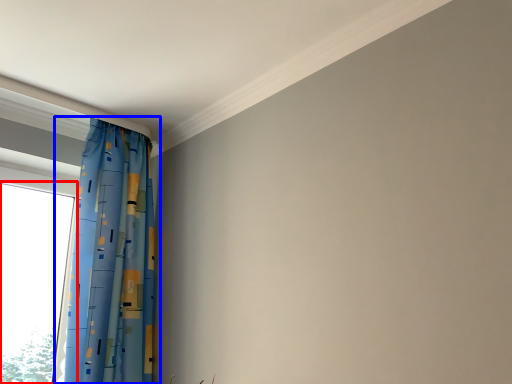
Question: Among these objects, which one is farthest to the camera, window (highlighted by a red box) or curtain (highlighted by a blue box)?

Choices:
 (A) window
 (B) curtain

Answer: (A)